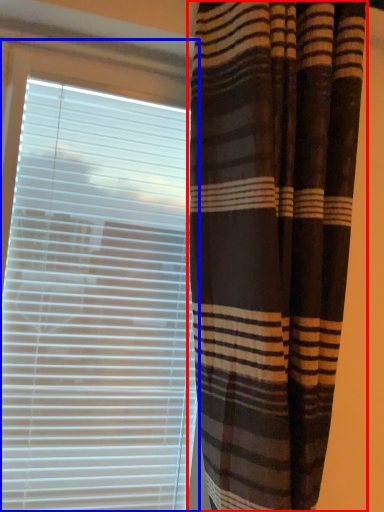
Question: Which object is further to the camera taking this photo, curtain (highlighted by a red box) or window blind (highlighted by a blue box)?

Choices:
 (A) curtain
 (B) window blind

Answer: (B)